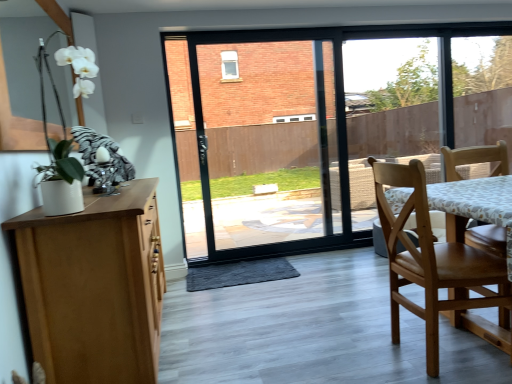
Question: Is white matte orchid at upper left wider or thinner than wooden chair at right?

Choices:
 (A) thin
 (B) wide

Answer: (A)

Question: Is white matte orchid at upper left to the left or to the right of wooden chair at right in the image?

Choices:
 (A) left
 (B) right

Answer: (A)

Question: Considering the positions of white matte orchid at upper left and wooden chair at right in the image, is white matte orchid at upper left taller or shorter than wooden chair at right?

Choices:
 (A) tall
 (B) short

Answer: (B)

Question: In terms of width, does wooden chair at right look wider or thinner when compared to white matte orchid at upper left?

Choices:
 (A) wide
 (B) thin

Answer: (A)

Question: Considering the positions of wooden chair at right and white matte orchid at upper left in the image, is wooden chair at right bigger or smaller than white matte orchid at upper left?

Choices:
 (A) big
 (B) small

Answer: (A)

Question: From a real-world perspective, is wooden chair at right above or below white matte orchid at upper left?

Choices:
 (A) below
 (B) above

Answer: (A)

Question: Does point (410, 281) appear closer or farther from the camera than point (31, 39)?

Choices:
 (A) closer
 (B) farther

Answer: (A)